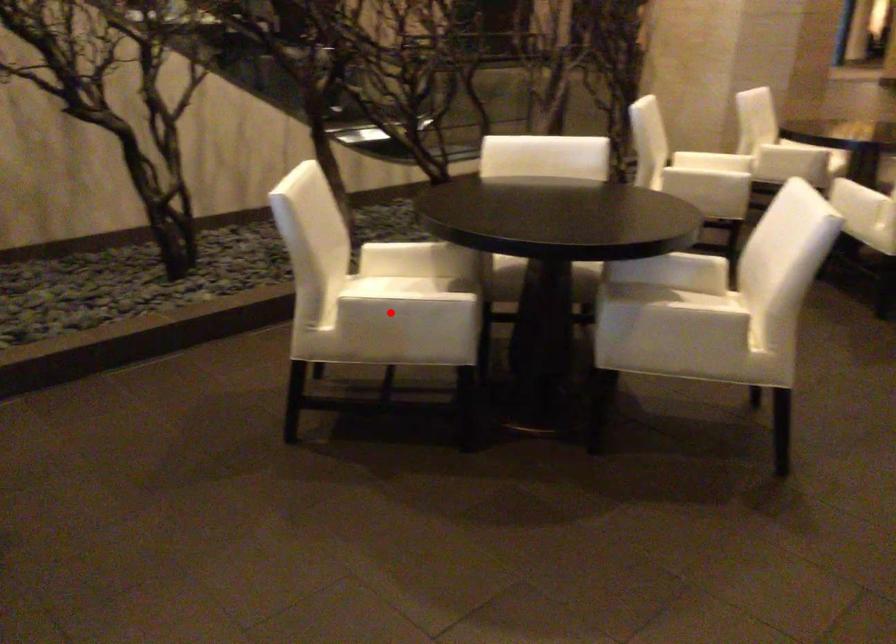
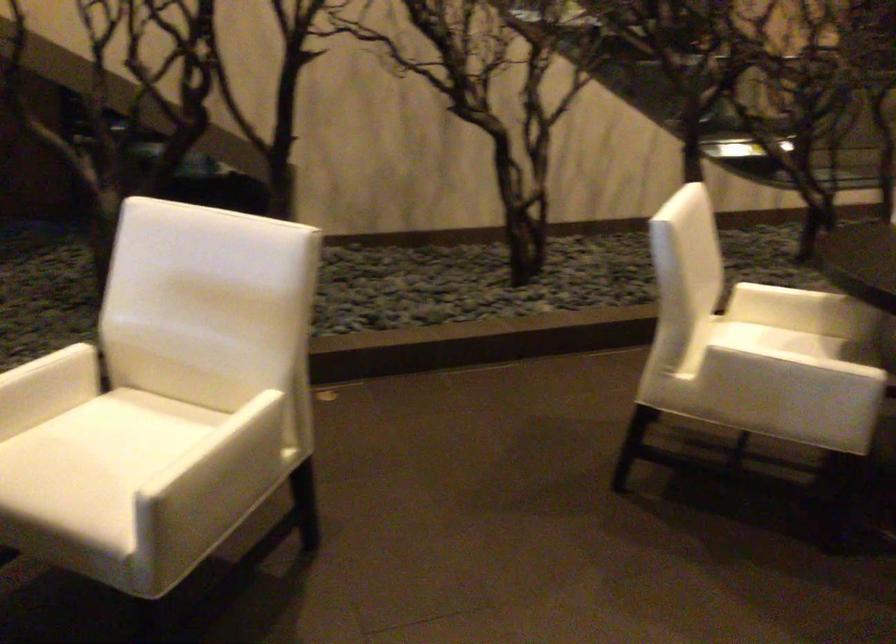
The point at the highlighted location is marked in the first image. Where is the corresponding point in the second image?

(771, 371)